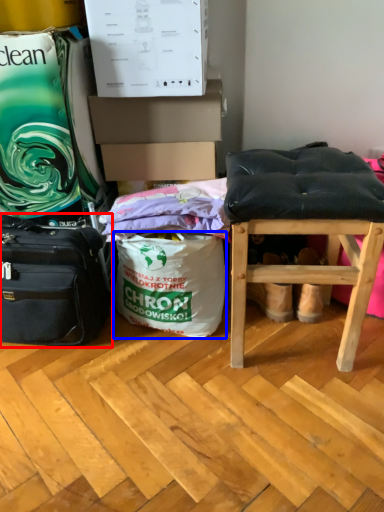
Question: Which point is closer to the camera, luggage and bags (highlighted by a red box) or shopping bag (highlighted by a blue box)?

Choices:
 (A) luggage and bags
 (B) shopping bag

Answer: (A)